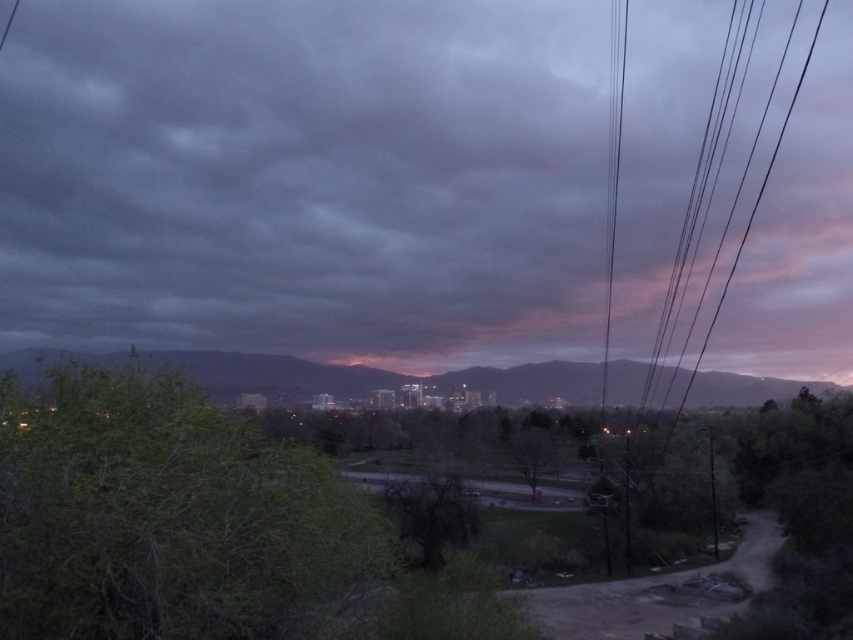
Describe the element at coordinates (173, 518) in the screenshot. I see `green leafy tree at lower left` at that location.

Does green leafy tree at lower left come in front of bare branches at center?

That is True.

Who is more distant from viewer, [61,634] or [521,435]?

The point [521,435] is more distant.

Where is `green leafy tree at lower left`? Image resolution: width=853 pixels, height=640 pixels. green leafy tree at lower left is located at coordinates (173, 518).

Consider the image. Does black wire at right appear on the right side of bare branches at center?

Yes, black wire at right is to the right of bare branches at center.

Is black wire at right positioned before bare branches at center?

No.

You are a GUI agent. You are given a task and a screenshot of the screen. Output one action in this format:
    pyautogui.click(x=<x>, y=<y>)
    Task: Click on the black wire at right
    
    Given the screenshot: What is the action you would take?
    pyautogui.click(x=613, y=172)

Which is more to the right, green leafy tree at lower left or rocky mountain at center?

rocky mountain at center

Can you confirm if green leafy tree at lower left is taller than rocky mountain at center?

In fact, green leafy tree at lower left may be shorter than rocky mountain at center.

Does point (9, 520) come closer to viewer compared to point (758, 396)?

Yes, point (9, 520) is in front of point (758, 396).

Find the location of a particular element. The image size is (853, 640). green leafy tree at lower left is located at coordinates (173, 518).